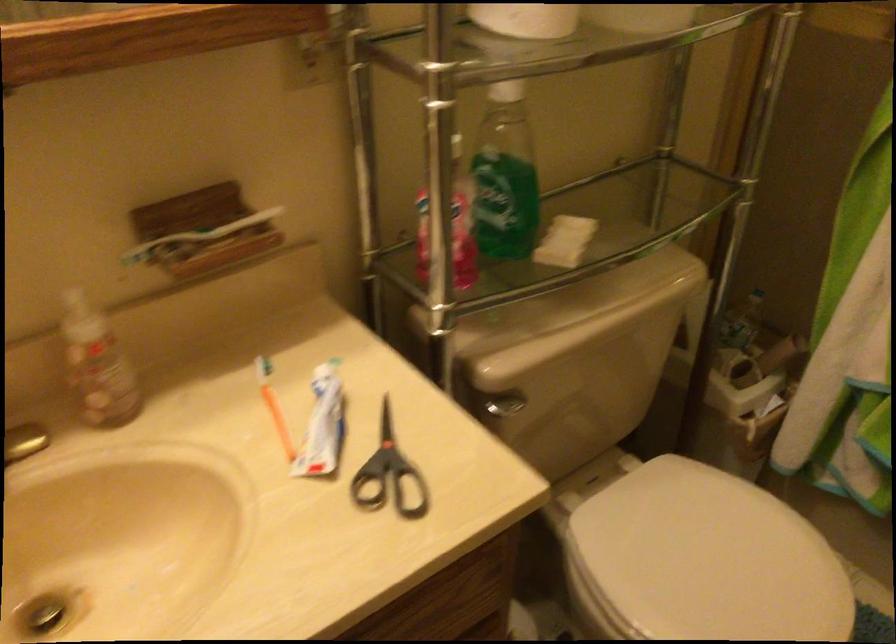
What do you see at coordinates (323, 424) in the screenshot?
I see `a toothpaste tube` at bounding box center [323, 424].